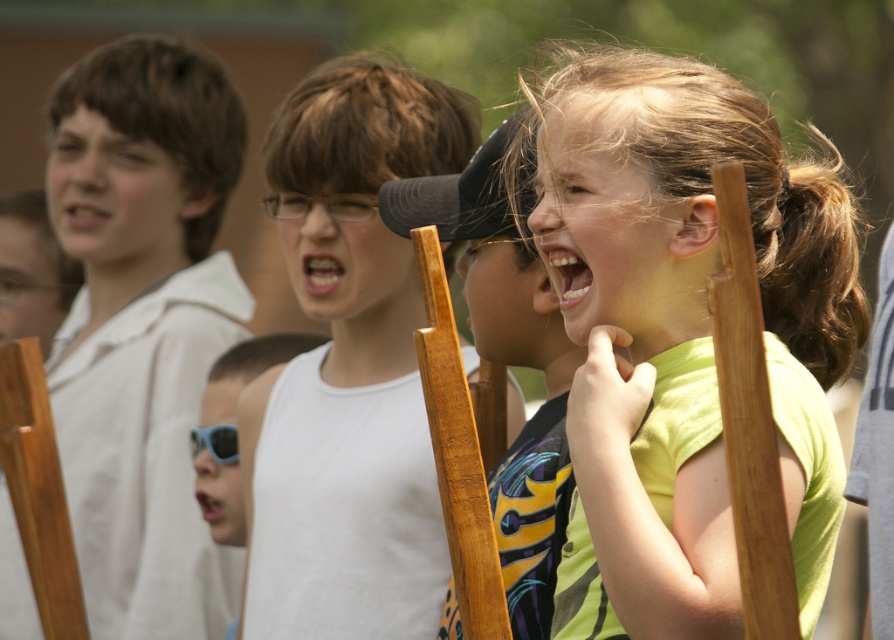
Question: Which point is farther to the camera?

Choices:
 (A) matte black cap at center
 (B) green matte shirt at center
 (C) blue plastic goggles at lower left
 (D) blue plastic sunglasses at center

Answer: (C)

Question: Is white matte tank top at center behind blue plastic sunglasses at center?

Choices:
 (A) no
 (B) yes

Answer: (A)

Question: Which object is the closest to the blue plastic sunglasses at center?

Choices:
 (A) matte black cap at center
 (B) white matte tank top at center
 (C) green matte shirt at center

Answer: (B)

Question: Can you confirm if green matte shirt at center is wider than white matte tank top at center?

Choices:
 (A) no
 (B) yes

Answer: (A)

Question: Does blue plastic sunglasses at center come behind blue plastic goggles at lower left?

Choices:
 (A) no
 (B) yes

Answer: (A)

Question: Which of these objects is positioned closest to the green matte shirt at center?

Choices:
 (A) matte black cap at center
 (B) white matte tank top at center

Answer: (A)